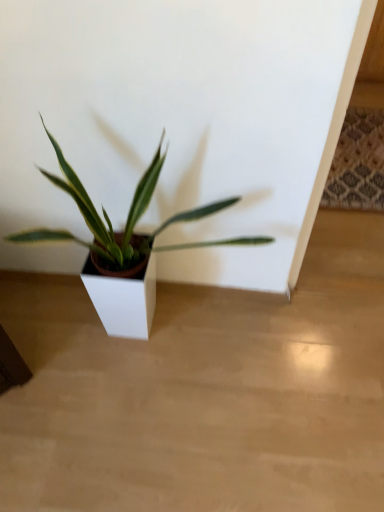
Where is `free point below green glossy plant at center (from a real-world perspective)`? Image resolution: width=384 pixels, height=512 pixels. free point below green glossy plant at center (from a real-world perspective) is located at coordinates (176, 347).